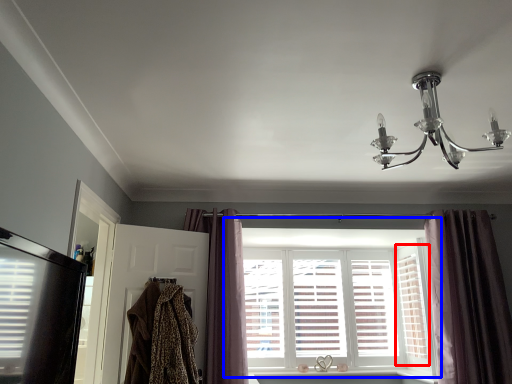
Question: Which point is further to the camera, shutter (highlighted by a red box) or window (highlighted by a blue box)?

Choices:
 (A) shutter
 (B) window

Answer: (B)